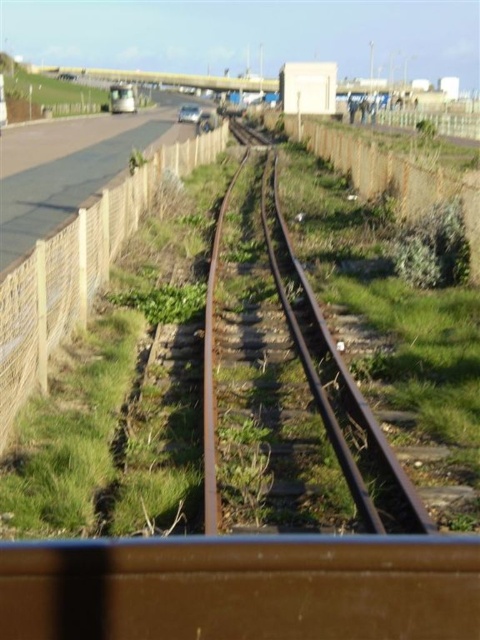
Consider the image. Is brown woven fence at left below rusty metal track at center?

Actually, brown woven fence at left is above rusty metal track at center.

Identify the location of brown woven fence at left. (78, 269).

This screenshot has width=480, height=640. I want to click on brown woven fence at left, so point(78,269).

From the picture: Measure the distance from rusty metal track at center to metallic silver bus at upper left.

224.33 feet

Does rusty metal track at center appear under metallic silver bus at upper left?

Correct, rusty metal track at center is located below metallic silver bus at upper left.

Locate an element on the screen. rusty metal track at center is located at coordinates (333, 374).

Which is above, green grass at center or metallic silver bus at upper left?

Positioned higher is metallic silver bus at upper left.

Looking at this image, is green grass at center positioned behind metallic silver bus at upper left?

No, it is in front of metallic silver bus at upper left.

This screenshot has width=480, height=640. Identify the location of green grass at center. (251, 364).

Image resolution: width=480 pixels, height=640 pixels. I want to click on green grass at center, so click(251, 364).